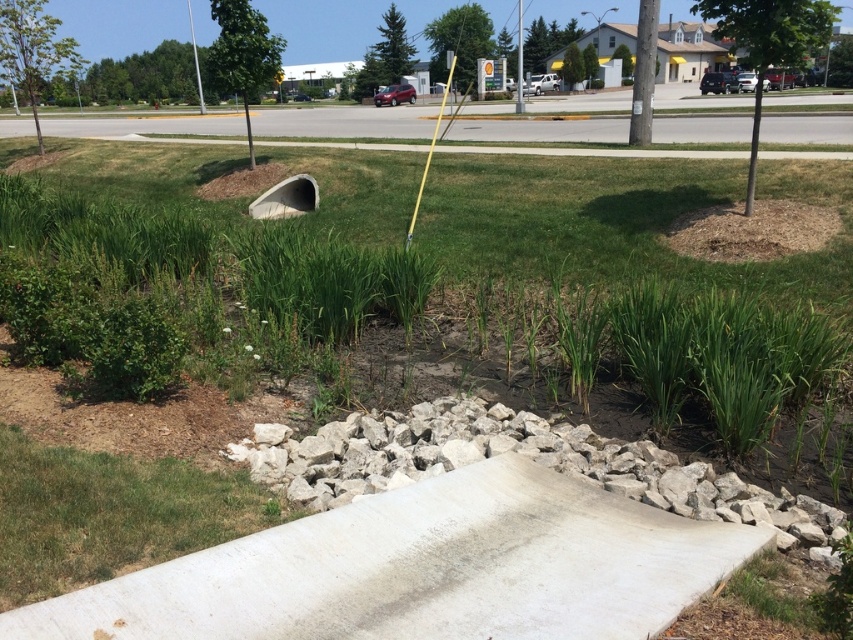
Between white concrete ramp at lower center and concrete tunnel at center, which one appears on the left side from the viewer's perspective?

concrete tunnel at center

Does white concrete ramp at lower center appear on the left side of concrete tunnel at center?

Incorrect, white concrete ramp at lower center is not on the left side of concrete tunnel at center.

I want to click on white concrete ramp at lower center, so click(x=424, y=570).

Between white concrete ramp at lower center and green grass at lower left, which one is positioned higher?

green grass at lower left

Is white concrete ramp at lower center further to camera compared to green grass at lower left?

No, white concrete ramp at lower center is in front of green grass at lower left.

Is point (393, 534) positioned in front of point (62, 515)?

Yes, it is.

Locate an element on the screen. white concrete ramp at lower center is located at coordinates (x=424, y=570).

Is white gravel at lower center shorter than green grass at lower left?

No.

Does point (637, 481) come behind point (183, 529)?

Yes, it is behind point (183, 529).

This screenshot has width=853, height=640. Find the location of `white gravel at lower center`. white gravel at lower center is located at coordinates (518, 452).